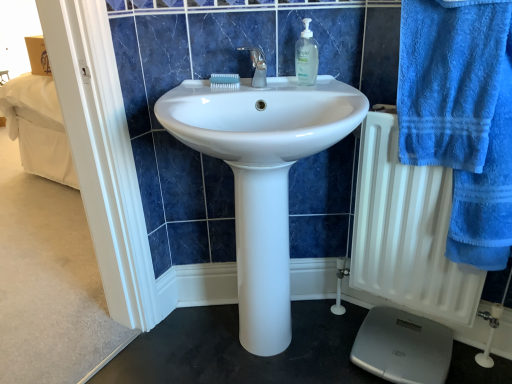
Question: From a real-world perspective, is blue terry cloth towel at right below white glossy sink at center?

Choices:
 (A) yes
 (B) no

Answer: (B)

Question: Does blue terry cloth towel at right have a smaller size compared to white glossy sink at center?

Choices:
 (A) no
 (B) yes

Answer: (B)

Question: From a real-world perspective, does blue terry cloth towel at right stand above white glossy sink at center?

Choices:
 (A) yes
 (B) no

Answer: (A)

Question: Is the position of blue terry cloth towel at right more distant than that of white glossy sink at center?

Choices:
 (A) yes
 (B) no

Answer: (B)

Question: From the image's perspective, does blue terry cloth towel at right appear lower than white glossy sink at center?

Choices:
 (A) yes
 (B) no

Answer: (B)

Question: Can we say blue terry cloth towel at right lies outside white glossy sink at center?

Choices:
 (A) yes
 (B) no

Answer: (A)

Question: Considering the relative positions of clear plastic soap dispenser at upper center and blue terry cloth towel at right in the image provided, is clear plastic soap dispenser at upper center to the right of blue terry cloth towel at right from the viewer's perspective?

Choices:
 (A) yes
 (B) no

Answer: (B)

Question: Is clear plastic soap dispenser at upper center next to blue terry cloth towel at right?

Choices:
 (A) no
 (B) yes

Answer: (A)

Question: Considering the relative sizes of clear plastic soap dispenser at upper center and blue terry cloth towel at right in the image provided, is clear plastic soap dispenser at upper center bigger than blue terry cloth towel at right?

Choices:
 (A) no
 (B) yes

Answer: (A)

Question: Does clear plastic soap dispenser at upper center have a lesser height compared to blue terry cloth towel at right?

Choices:
 (A) yes
 (B) no

Answer: (A)

Question: From a real-world perspective, is clear plastic soap dispenser at upper center located higher than blue terry cloth towel at right?

Choices:
 (A) yes
 (B) no

Answer: (A)

Question: Is clear plastic soap dispenser at upper center turned away from blue terry cloth towel at right?

Choices:
 (A) yes
 (B) no

Answer: (B)

Question: Considering the relative sizes of gray plastic scale at lower right and blue terry cloth towel at right in the image provided, is gray plastic scale at lower right shorter than blue terry cloth towel at right?

Choices:
 (A) yes
 (B) no

Answer: (A)